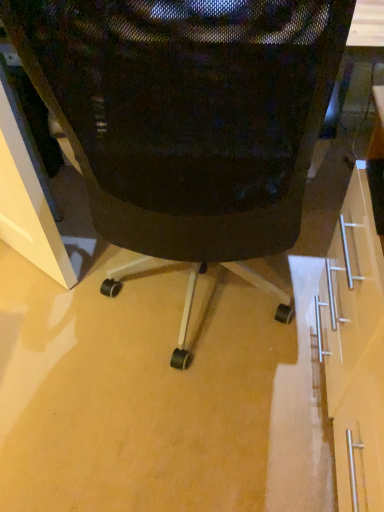
What do you see at coordinates (187, 113) in the screenshot? The width and height of the screenshot is (384, 512). I see `black mesh chair at center` at bounding box center [187, 113].

Measure the distance between black mesh chair at center and camera.

The distance of black mesh chair at center from camera is 19.61 inches.

Identify the location of black mesh chair at center. (187, 113).

Locate an element on the screen. black mesh chair at center is located at coordinates click(x=187, y=113).